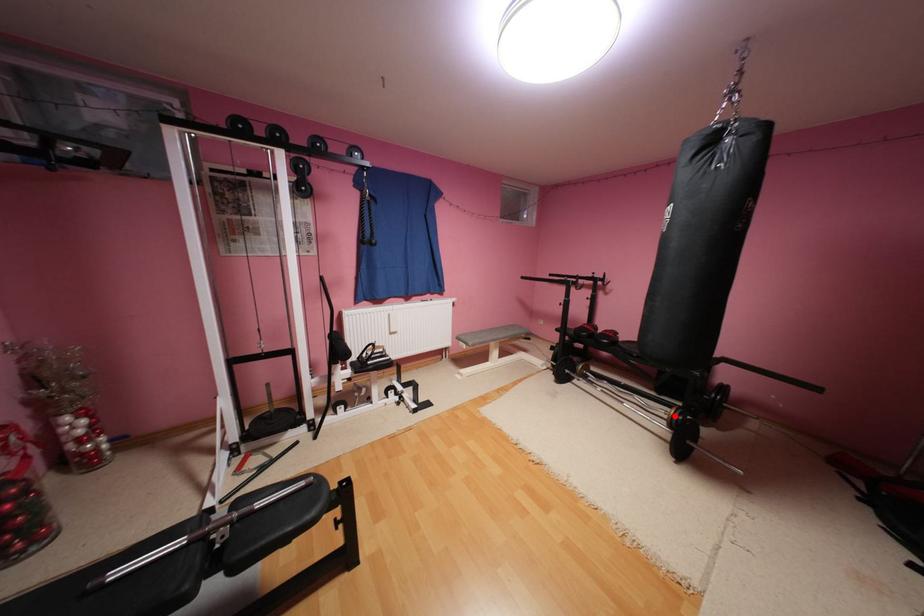
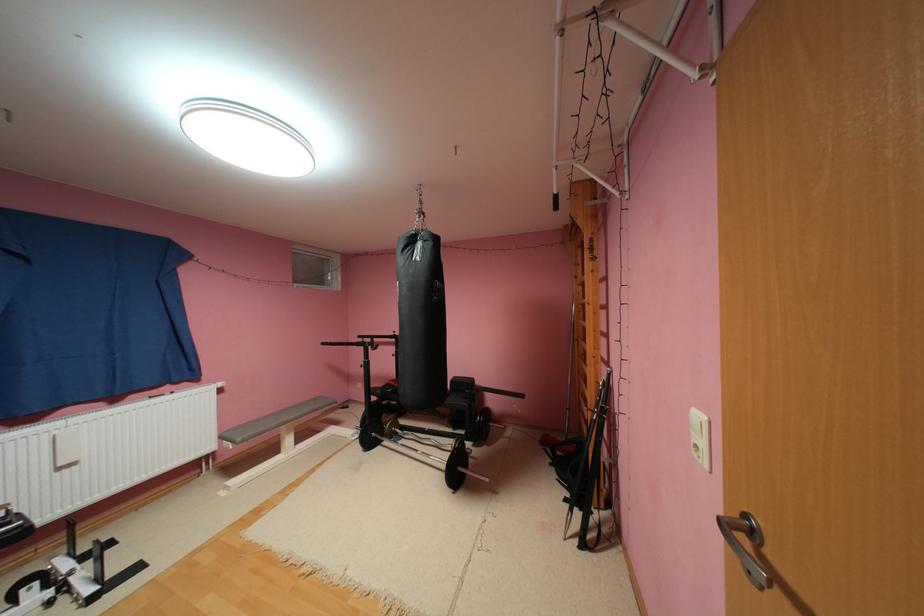
Question: I am providing you with two images of the same scene from different viewpoints. A red point is shown in image1. For the corresponding object point in image2, is it positioned nearer or farther from the camera?

Choices:
 (A) Nearer
 (B) Farther

Answer: (A)